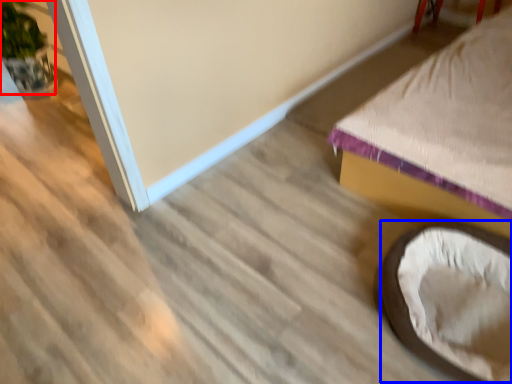
Question: Which point is closer to the camera, plant (highlighted by a red box) or bean bag chair (highlighted by a blue box)?

Choices:
 (A) plant
 (B) bean bag chair

Answer: (B)